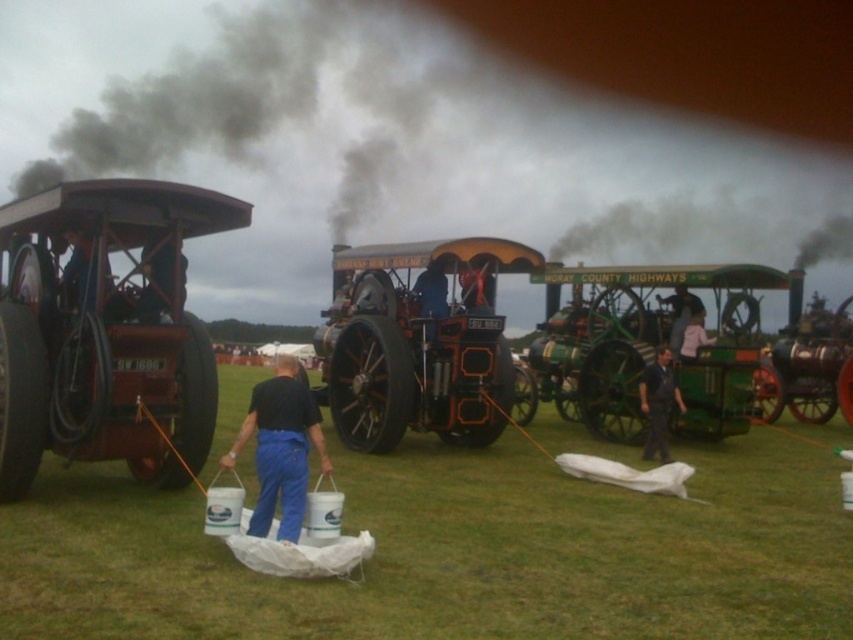
Which is above, matte black tractor at left or pink fabric at center?

Positioned higher is pink fabric at center.

What do you see at coordinates (105, 330) in the screenshot? I see `matte black tractor at left` at bounding box center [105, 330].

Find the location of a particular element. This screenshot has width=853, height=640. matte black tractor at left is located at coordinates (105, 330).

Is point (148, 284) positioned after point (691, 358)?

No, (148, 284) is in front of (691, 358).

Looking at this image, is metallic blue overalls at center wider than pink fabric at center?

No, metallic blue overalls at center is not wider than pink fabric at center.

Measure the distance between metallic blue overalls at center and camera.

metallic blue overalls at center and camera are 26.47 feet apart.

Where is `metallic blue overalls at center`? This screenshot has height=640, width=853. metallic blue overalls at center is located at coordinates (155, 280).

Can you confirm if dark blue fabric at center is taller than metallic blue overalls at center?

Yes, dark blue fabric at center is taller than metallic blue overalls at center.

At what (x,y) coordinates should I click in order to perform the action: click on dark blue fabric at center. Please return your answer as a coordinate pair (x, y). Looking at the image, I should click on point(659,404).